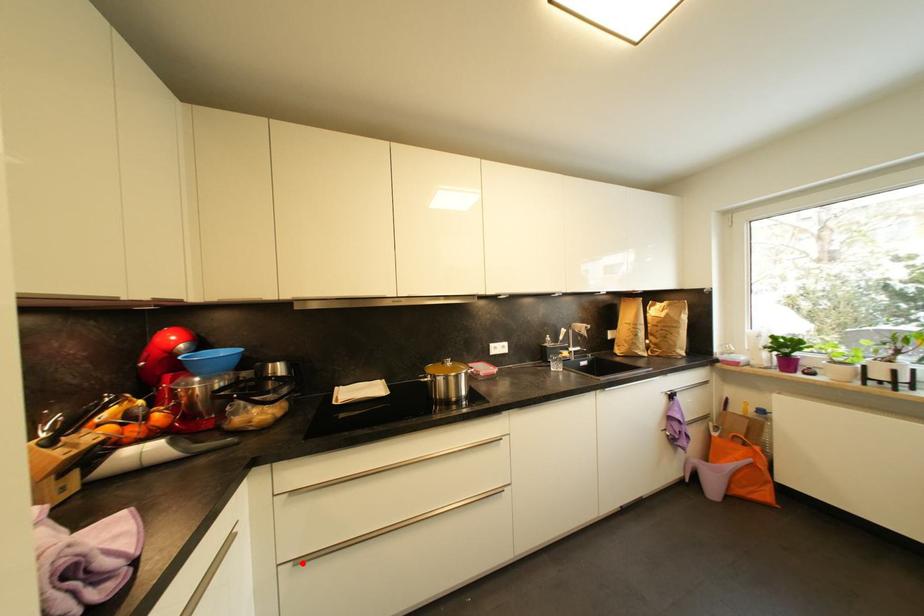
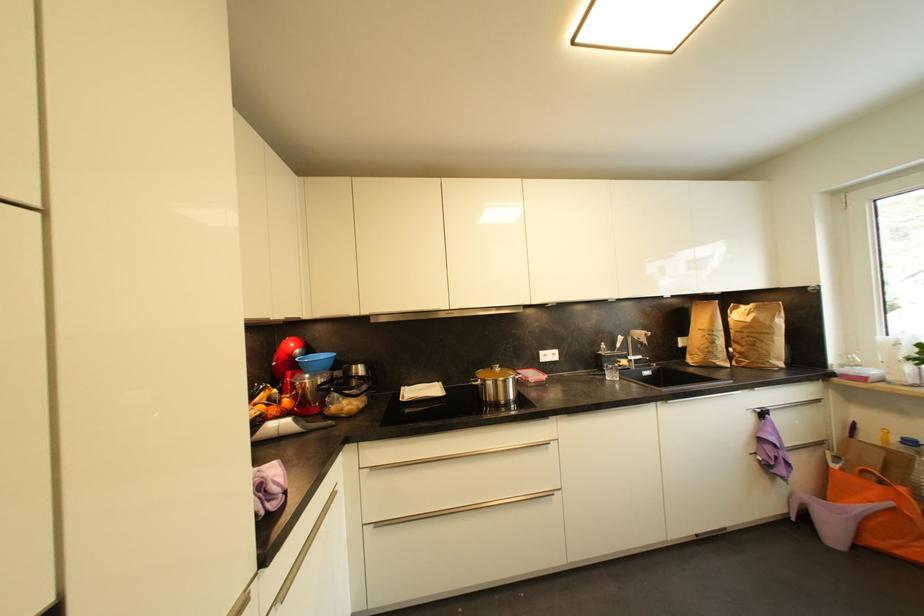
Find the pixel in the second image that matches the highlighted location in the first image.

(382, 527)